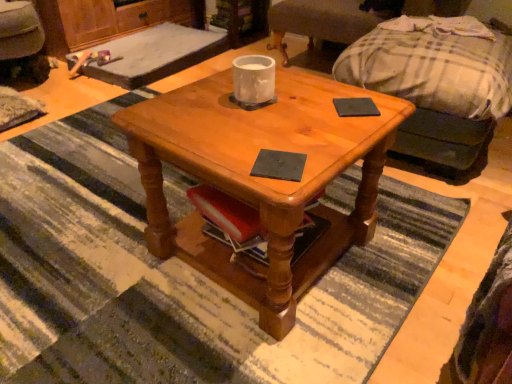
Locate an element on the screen. free space in front of black matte pad at center, the second pad in the front-to-back sequence is located at coordinates (347, 132).